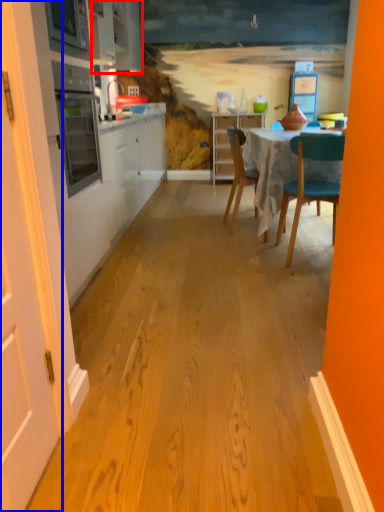
Question: Among these objects, which one is farthest to the camera, cabinetry (highlighted by a red box) or door (highlighted by a blue box)?

Choices:
 (A) cabinetry
 (B) door

Answer: (A)